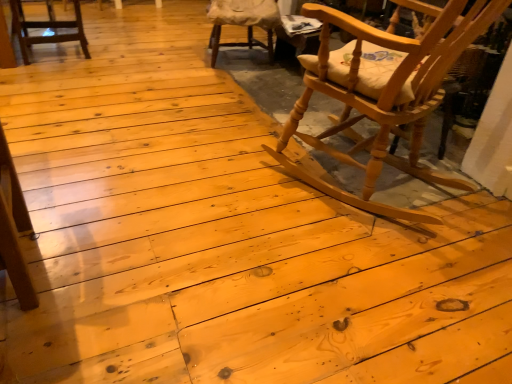
What are the coordinates of `wooden cushioned chair at upper center, the 2th chair from the left` in the screenshot? It's located at (242, 22).

What is the approximate height of wooden cushioned chair at upper center, arranged as the third chair when viewed from the front?

47.62 centimeters.

Find the location of `wooden cushioned chair at upper center, positioned as the second chair in right-to-left order`. wooden cushioned chair at upper center, positioned as the second chair in right-to-left order is located at coordinates (242, 22).

Who is smaller, natural wood rocking chair at right, acting as the 1th chair starting from the right, or matte wood chair at upper left, which is the 2th chair in back-to-front order?

matte wood chair at upper left, which is the 2th chair in back-to-front order.

From a real-world perspective, is natural wood rocking chair at right, arranged as the 1th chair when viewed from the front, physically below matte wood chair at upper left, which is the 2th chair in back-to-front order?

Incorrect, from a real-world perspective, natural wood rocking chair at right, arranged as the 1th chair when viewed from the front, is higher than matte wood chair at upper left, which is the 2th chair in back-to-front order.

Is point (483, 26) closer or farther from the camera than point (14, 17)?

Clearly, point (483, 26) is closer to the camera than point (14, 17).

Which chair is the 1st one when counting from the back of the natural wood rocking chair at right, which is the third chair from left to right? Please provide its 2D coordinates.

[(46, 28)]

Which is more to the right, wooden cushioned chair at upper center, positioned as the second chair in right-to-left order, or matte wood chair at upper left, the 2th chair in the front-to-back sequence?

From the viewer's perspective, wooden cushioned chair at upper center, positioned as the second chair in right-to-left order, appears more on the right side.

Is wooden cushioned chair at upper center, positioned as the second chair in right-to-left order, closer to the viewer compared to matte wood chair at upper left, which is the 2th chair in back-to-front order?

That is False.

From the image's perspective, does wooden cushioned chair at upper center, the 2th chair from the left, appear higher than matte wood chair at upper left, which is the 2th chair in back-to-front order?

Yes, from the image's perspective, wooden cushioned chair at upper center, the 2th chair from the left, is on top of matte wood chair at upper left, which is the 2th chair in back-to-front order.

Considering the sizes of wooden cushioned chair at upper center, placed as the first chair when sorted from back to front, and matte wood chair at upper left, the 2th chair in the front-to-back sequence, in the image, is wooden cushioned chair at upper center, placed as the first chair when sorted from back to front, wider or thinner than matte wood chair at upper left, the 2th chair in the front-to-back sequence,?

Considering their sizes, wooden cushioned chair at upper center, placed as the first chair when sorted from back to front, looks broader than matte wood chair at upper left, the 2th chair in the front-to-back sequence.

Which object is thinner, natural wood rocking chair at right, which is the 3th chair from back to front, or wooden cushioned chair at upper center, placed as the first chair when sorted from back to front?

wooden cushioned chair at upper center, placed as the first chair when sorted from back to front, is thinner.

In the scene shown: Is the surface of natural wood rocking chair at right, acting as the 1th chair starting from the right, in direct contact with wooden cushioned chair at upper center, the 2th chair from the left?

No, natural wood rocking chair at right, acting as the 1th chair starting from the right, is not touching wooden cushioned chair at upper center, the 2th chair from the left.

Is natural wood rocking chair at right, which is the 3th chair from back to front, in front of or behind wooden cushioned chair at upper center, the 2th chair from the left, in the image?

Clearly, natural wood rocking chair at right, which is the 3th chair from back to front, is in front of wooden cushioned chair at upper center, the 2th chair from the left.

The image size is (512, 384). I want to click on chair that is the 1st one below the natural wood rocking chair at right, which is the 3th chair from back to front (from a real-world perspective), so click(x=242, y=22).

This screenshot has height=384, width=512. In order to click on chair below the matte wood chair at upper left, the 2th chair in the front-to-back sequence (from the image's perspective) in this screenshot , I will do `click(383, 91)`.

Is matte wood chair at upper left, which is the 3th chair in right-to-left order, inside the boundaries of natural wood rocking chair at right, arranged as the 1th chair when viewed from the front, or outside?

matte wood chair at upper left, which is the 3th chair in right-to-left order, is spatially situated outside natural wood rocking chair at right, arranged as the 1th chair when viewed from the front.

Considering the sizes of objects matte wood chair at upper left, marked as the 1th chair in a left-to-right arrangement, and natural wood rocking chair at right, which is the third chair from left to right, in the image provided, who is thinner, matte wood chair at upper left, marked as the 1th chair in a left-to-right arrangement, or natural wood rocking chair at right, which is the third chair from left to right,?

matte wood chair at upper left, marked as the 1th chair in a left-to-right arrangement, is thinner.

Between matte wood chair at upper left, which is the 3th chair in right-to-left order, and natural wood rocking chair at right, arranged as the 1th chair when viewed from the front, which one has smaller size?

matte wood chair at upper left, which is the 3th chair in right-to-left order.

Between matte wood chair at upper left, marked as the 1th chair in a left-to-right arrangement, and wooden cushioned chair at upper center, placed as the first chair when sorted from back to front, which one is positioned behind?

Positioned behind is wooden cushioned chair at upper center, placed as the first chair when sorted from back to front.

Looking at the image, does matte wood chair at upper left, which is the 2th chair in back-to-front order, seem bigger or smaller compared to wooden cushioned chair at upper center, positioned as the second chair in right-to-left order?

In the image, matte wood chair at upper left, which is the 2th chair in back-to-front order, appears to be smaller than wooden cushioned chair at upper center, positioned as the second chair in right-to-left order.

From a real-world perspective, is matte wood chair at upper left, which is the 2th chair in back-to-front order, on top of wooden cushioned chair at upper center, positioned as the second chair in right-to-left order?

Actually, matte wood chair at upper left, which is the 2th chair in back-to-front order, is physically below wooden cushioned chair at upper center, positioned as the second chair in right-to-left order, in the real world.

From the image's perspective, between wooden cushioned chair at upper center, arranged as the third chair when viewed from the front, and natural wood rocking chair at right, arranged as the 1th chair when viewed from the front, who is located below?

From the image's view, natural wood rocking chair at right, arranged as the 1th chair when viewed from the front, is below.

Considering the positions of objects wooden cushioned chair at upper center, arranged as the third chair when viewed from the front, and natural wood rocking chair at right, arranged as the 1th chair when viewed from the front, in the image provided, who is behind, wooden cushioned chair at upper center, arranged as the third chair when viewed from the front, or natural wood rocking chair at right, arranged as the 1th chair when viewed from the front,?

wooden cushioned chair at upper center, arranged as the third chair when viewed from the front.

From a real-world perspective, which object rests below the other?

wooden cushioned chair at upper center, the 2th chair from the left, is physically lower.

What's the angular difference between wooden cushioned chair at upper center, the 2th chair from the left, and natural wood rocking chair at right, which is the 3th chair from back to front,'s facing directions?

The angular difference between wooden cushioned chair at upper center, the 2th chair from the left, and natural wood rocking chair at right, which is the 3th chair from back to front, is 148 degrees.

The image size is (512, 384). I want to click on chair in front of the matte wood chair at upper left, which is the 3th chair in right-to-left order, so click(383, 91).

I want to click on chair above the matte wood chair at upper left, the 2th chair in the front-to-back sequence (from the image's perspective), so click(242, 22).

When comparing their distances from wooden cushioned chair at upper center, placed as the first chair when sorted from back to front, does matte wood chair at upper left, which is the 3th chair in right-to-left order, or natural wood rocking chair at right, which is the third chair from left to right, seem further?

natural wood rocking chair at right, which is the third chair from left to right, is further to wooden cushioned chair at upper center, placed as the first chair when sorted from back to front.

Estimate the real-world distances between objects in this image. Which object is closer to wooden cushioned chair at upper center, arranged as the third chair when viewed from the front, natural wood rocking chair at right, acting as the 1th chair starting from the right, or matte wood chair at upper left, which is the 2th chair in back-to-front order?

matte wood chair at upper left, which is the 2th chair in back-to-front order, lies closer to wooden cushioned chair at upper center, arranged as the third chair when viewed from the front, than the other object.

From the picture: Based on their spatial positions, is natural wood rocking chair at right, acting as the 1th chair starting from the right, or wooden cushioned chair at upper center, placed as the first chair when sorted from back to front, further from matte wood chair at upper left, which is the 2th chair in back-to-front order?

natural wood rocking chair at right, acting as the 1th chair starting from the right.

Which object lies further to the anchor point natural wood rocking chair at right, acting as the 1th chair starting from the right, wooden cushioned chair at upper center, placed as the first chair when sorted from back to front, or matte wood chair at upper left, marked as the 1th chair in a left-to-right arrangement?

Based on the image, matte wood chair at upper left, marked as the 1th chair in a left-to-right arrangement, appears to be further to natural wood rocking chair at right, acting as the 1th chair starting from the right.

Considering their positions, is wooden cushioned chair at upper center, placed as the first chair when sorted from back to front, positioned closer to matte wood chair at upper left, marked as the 1th chair in a left-to-right arrangement, than natural wood rocking chair at right, which is the 3th chair from back to front?

wooden cushioned chair at upper center, placed as the first chair when sorted from back to front.

Looking at the image, which one is located further to natural wood rocking chair at right, which is the third chair from left to right, matte wood chair at upper left, which is the 2th chair in back-to-front order, or wooden cushioned chair at upper center, the 2th chair from the left?

Among the two, matte wood chair at upper left, which is the 2th chair in back-to-front order, is located further to natural wood rocking chair at right, which is the third chair from left to right.

This screenshot has width=512, height=384. I want to click on chair between matte wood chair at upper left, marked as the 1th chair in a left-to-right arrangement, and natural wood rocking chair at right, which is the 3th chair from back to front, from left to right, so click(242, 22).